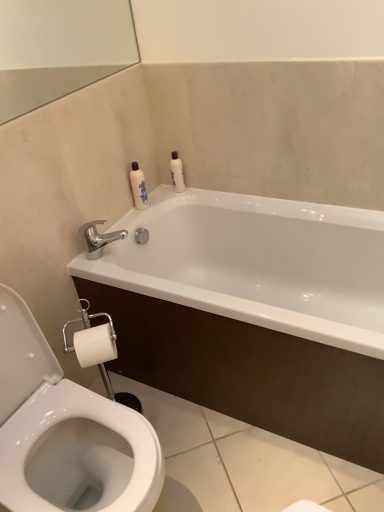
Locate an element on the screen. The height and width of the screenshot is (512, 384). vacant region to the right of white glossy bottle at upper right, arranged as the first toiletry when viewed from the right is located at coordinates tap(214, 189).